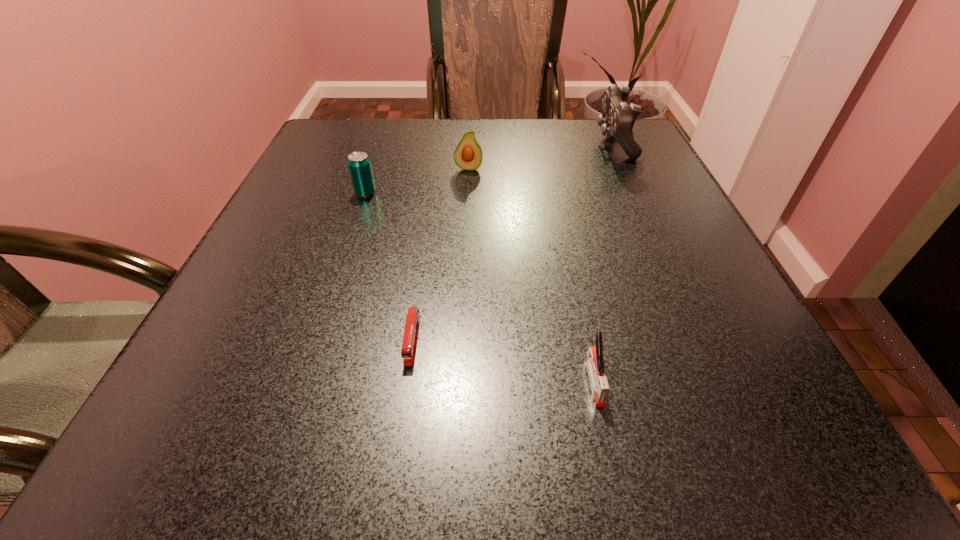
Where is `vacant space located on the surface of the control with buttons`? The width and height of the screenshot is (960, 540). vacant space located on the surface of the control with buttons is located at coordinates (480, 143).

You are a GUI agent. You are given a task and a screenshot of the screen. Output one action in this format:
    pyautogui.click(x=<x>, y=<y>)
    Task: Click on the free space located on the surface of the control with buttons
    Image resolution: width=960 pixels, height=540 pixels.
    Given the screenshot: What is the action you would take?
    pyautogui.click(x=565, y=143)

The image size is (960, 540). Find the location of `vacant space located 0.210m on the surface of the control with buttons`. vacant space located 0.210m on the surface of the control with buttons is located at coordinates (516, 143).

Identify the location of vacant area located 0.090m on the cut side of the avocado. The image size is (960, 540). (468, 194).

This screenshot has height=540, width=960. In order to click on vacant space located on the back of the beer can in this screenshot , I will do `click(379, 150)`.

At what (x,y) coordinates should I click in order to perform the action: click on free point located 0.050m on the handle side of the taller stapler. Please return your answer as a coordinate pair (x, y). This screenshot has height=540, width=960. Looking at the image, I should click on (608, 442).

At what (x,y) coordinates should I click in order to perform the action: click on vacant space located 0.060m on the front-facing side of the fourth object from right to left. Please return your answer as a coordinate pair (x, y). This screenshot has height=540, width=960. Looking at the image, I should click on (403, 403).

The width and height of the screenshot is (960, 540). In order to click on object that is at the far edge in this screenshot , I will do `click(618, 119)`.

I want to click on object present at the left edge, so click(359, 165).

Find the location of `object that is at the right edge`. object that is at the right edge is located at coordinates (618, 119).